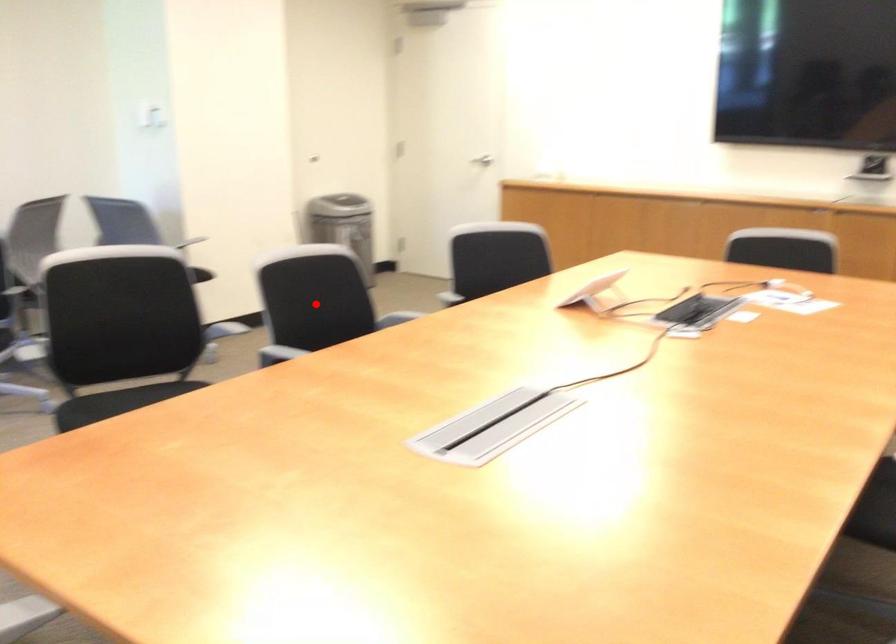
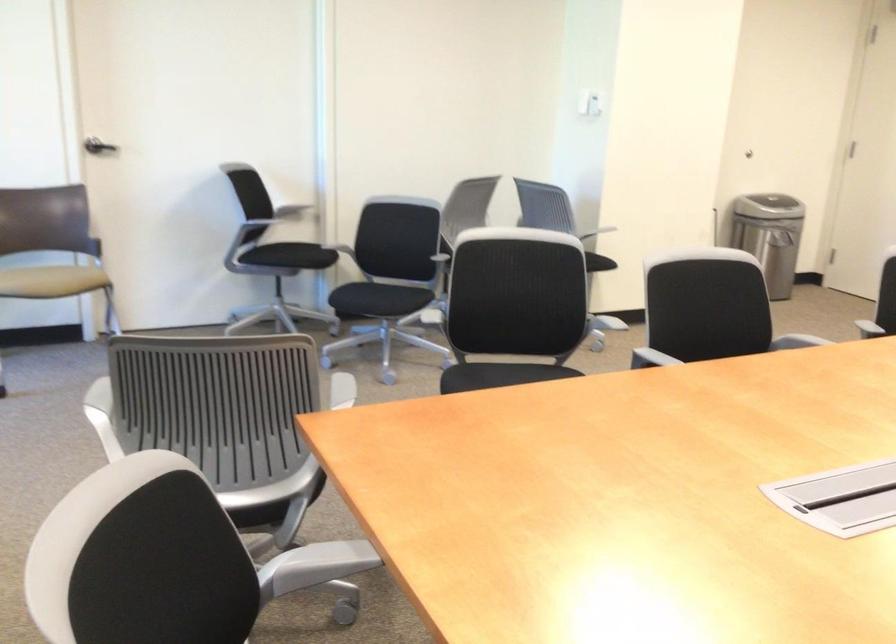
Where in the second image is the point corresponding to the highlighted location from the first image?

(708, 308)